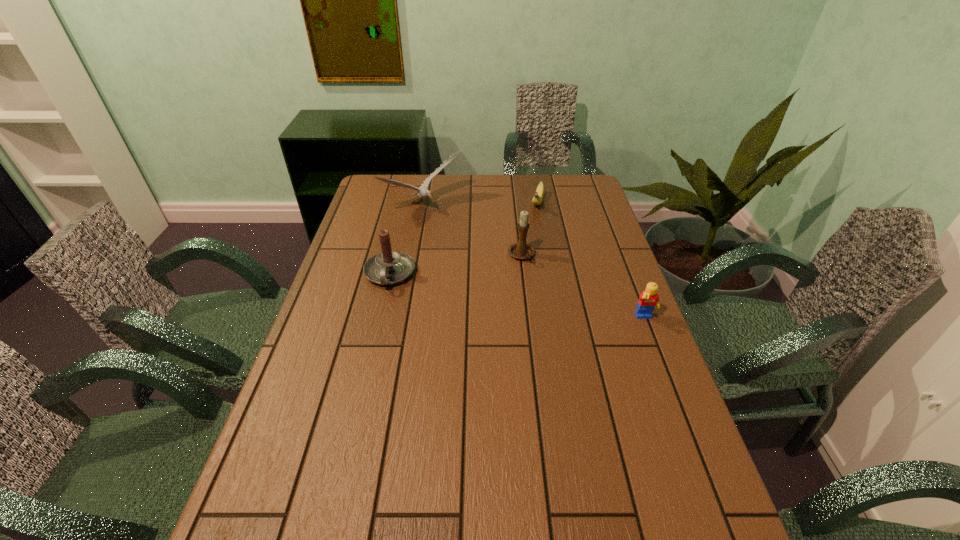
Where is `free space on the desktop that is between the candle and the nearest object and is positioned at the tip of the beak of the gull`? This screenshot has height=540, width=960. free space on the desktop that is between the candle and the nearest object and is positioned at the tip of the beak of the gull is located at coordinates (531, 298).

This screenshot has height=540, width=960. I want to click on vacant spot on the desktop that is between the candle and the nearest object and is positioned on the side of the third object from right to left with the handle, so click(540, 300).

Locate an element on the screen. free spot on the desktop that is between the candle and the rightmost object and is positioned at the stem of the fourth object from left to right is located at coordinates click(513, 295).